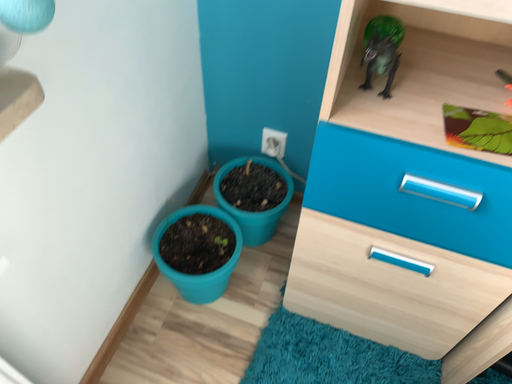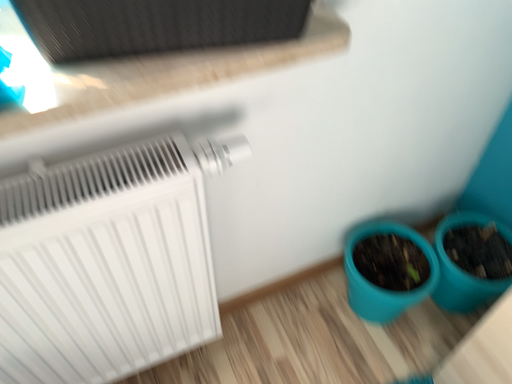
Question: How did the camera likely rotate when shooting the video?

Choices:
 (A) rotated left
 (B) rotated right

Answer: (A)